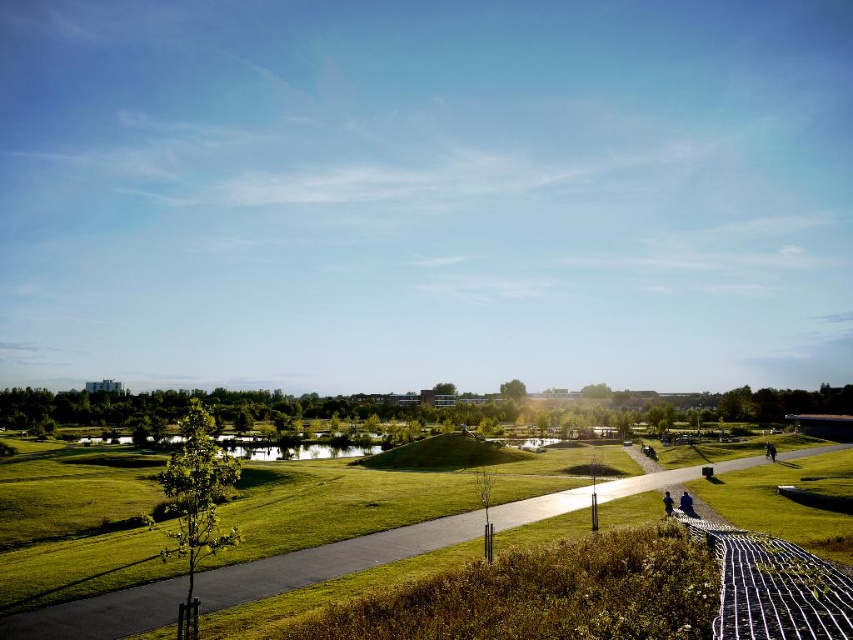
You are standing at the lower right corner of the image and want to walk towards the green grassy park at center. Which direction should you move relative to the white mesh fence at lower right?

To reach the green grassy park at center from the white mesh fence at lower right, you should move to the left since the green grassy park at center is positioned on the right side of the white mesh fence at lower right, meaning it is to the left relative to your starting position at the lower right corner.

You are a gardener who needs to water both the green grassy park at center and the white mesh fence at lower right. Given that your watering can holds enough water to cover 15 meters in a straight line, can you water both areas without refilling?

The green grassy park at center and white mesh fence at lower right are 17.20 meters apart, which exceeds the watering can capacity of 15 meters. Therefore, you cannot water both areas without refilling.